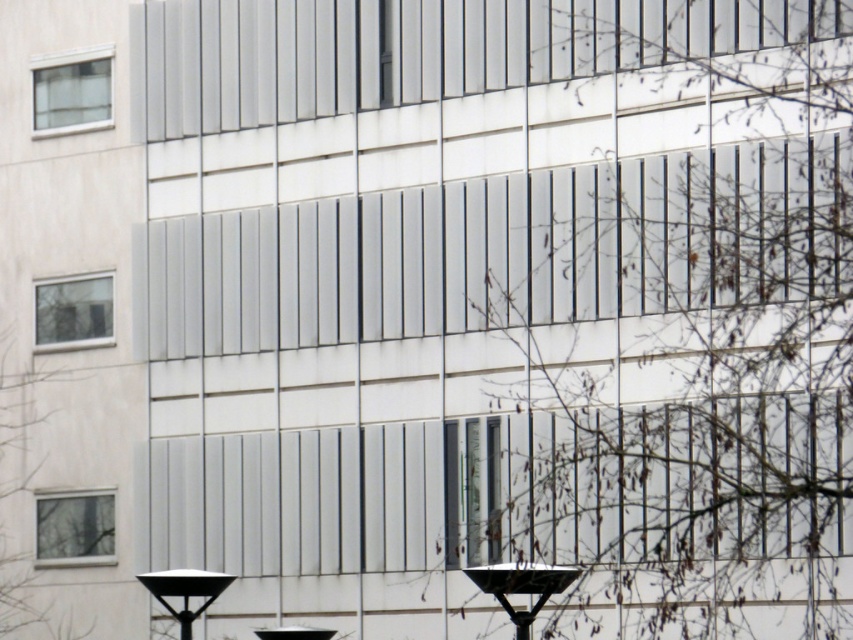
Question: Considering the real-world distances, which object is closest to the black matte lamp post at lower left?

Choices:
 (A) clear glass window at lower left
 (B) bare branches at center
 (C) clear glass window at upper left

Answer: (A)

Question: Which point is farther to the camera?

Choices:
 (A) (834, 452)
 (B) (170, 609)
 (C) (36, 70)

Answer: (C)

Question: Does clear glass window at lower left come behind clear glass window at left?

Choices:
 (A) yes
 (B) no

Answer: (B)

Question: Can you confirm if clear glass window at lower left is positioned to the left of black plastic streetlight at lower center?

Choices:
 (A) no
 (B) yes

Answer: (B)

Question: In this image, where is green leafy tree at lower left located relative to clear glass window at upper left?

Choices:
 (A) below
 (B) above

Answer: (A)

Question: Which point is closer to the camera?

Choices:
 (A) (48, 131)
 (B) (502, 568)

Answer: (B)